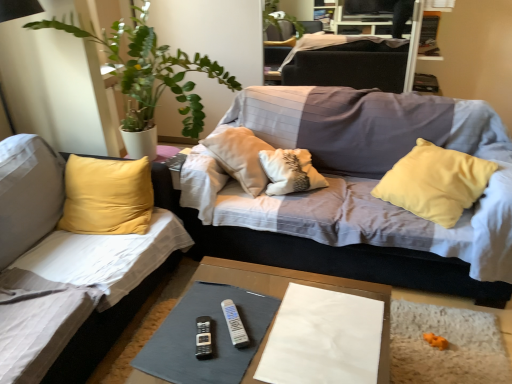
Locate an element on the screen. free space in front of white plastic remote at center, which is the 1th remote from right to left is located at coordinates (234, 360).